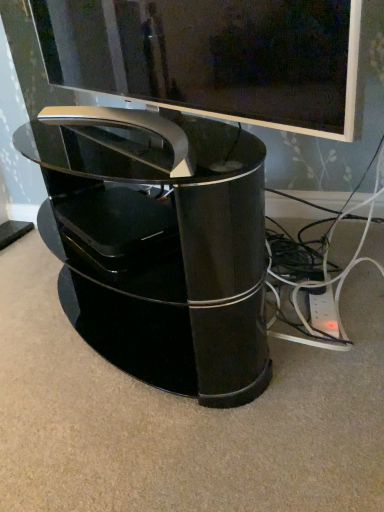
Identify the location of glossy black tv at upper center. Image resolution: width=384 pixels, height=512 pixels. (213, 57).

The width and height of the screenshot is (384, 512). Describe the element at coordinates (213, 57) in the screenshot. I see `glossy black tv at upper center` at that location.

What do you see at coordinates (160, 243) in the screenshot?
I see `glossy black tv stand at center` at bounding box center [160, 243].

The height and width of the screenshot is (512, 384). In order to click on glossy black tv stand at center in this screenshot , I will do `click(160, 243)`.

The height and width of the screenshot is (512, 384). Identify the location of glossy black tv at upper center. (213, 57).

Is glossy black tv at upper center at the right side of glossy black tv stand at center?

No.

Is glossy black tv at upper center closer to the viewer compared to glossy black tv stand at center?

Yes.

Is point (33, 8) behind point (79, 297)?

Yes, it is behind point (79, 297).

From the image's perspective, between glossy black tv at upper center and glossy black tv stand at center, who is located below?

glossy black tv stand at center appears lower in the image.

From a real-world perspective, is glossy black tv at upper center above or below glossy black tv stand at center?

glossy black tv at upper center is above glossy black tv stand at center.

Looking at this image, which object is wider, glossy black tv at upper center or glossy black tv stand at center?

glossy black tv stand at center is wider.

Who is taller, glossy black tv at upper center or glossy black tv stand at center?

With more height is glossy black tv stand at center.

Who is bigger, glossy black tv at upper center or glossy black tv stand at center?

glossy black tv stand at center.

Is glossy black tv at upper center not within glossy black tv stand at center?

Indeed, glossy black tv at upper center is completely outside glossy black tv stand at center.

Is glossy black tv at upper center far away from glossy black tv stand at center?

No.

Is glossy black tv at upper center looking in the opposite direction of glossy black tv stand at center?

glossy black tv at upper center does not have its back to glossy black tv stand at center.

How different are the orientations of glossy black tv at upper center and glossy black tv stand at center in degrees?

They differ by 1.19 degrees in their facing directions.

Find the location of `furniture below the glossy black tv at upper center (from a real-world perspective)`. furniture below the glossy black tv at upper center (from a real-world perspective) is located at coordinates (160, 243).

Does glossy black tv stand at center appear on the right side of glossy black tv at upper center?

Yes.

Does glossy black tv stand at center lie in front of glossy black tv at upper center?

No, glossy black tv stand at center is further to the viewer.

Does point (240, 131) come behind point (287, 121)?

Yes.

From the image's perspective, is glossy black tv stand at center positioned above or below glossy black tv at upper center?

Clearly, from the image's perspective, glossy black tv stand at center is below glossy black tv at upper center.

From a real-world perspective, which is physically below, glossy black tv stand at center or glossy black tv at upper center?

From a 3D spatial view, glossy black tv stand at center is below.

Considering the sizes of objects glossy black tv stand at center and glossy black tv at upper center in the image provided, who is wider, glossy black tv stand at center or glossy black tv at upper center?

glossy black tv stand at center is wider.

Between glossy black tv stand at center and glossy black tv at upper center, which one has more height?

Standing taller between the two is glossy black tv stand at center.

Considering the relative sizes of glossy black tv stand at center and glossy black tv at upper center in the image provided, is glossy black tv stand at center bigger than glossy black tv at upper center?

Indeed, glossy black tv stand at center has a larger size compared to glossy black tv at upper center.

From the picture: Would you say glossy black tv stand at center is inside or outside glossy black tv at upper center?

The correct answer is: outside.

Are glossy black tv stand at center and glossy black tv at upper center making contact?

No, glossy black tv stand at center is not beside glossy black tv at upper center.

Looking at this image, is glossy black tv stand at center looking in the opposite direction of glossy black tv at upper center?

No, glossy black tv stand at center is not facing away from glossy black tv at upper center.

How far apart are glossy black tv stand at center and glossy black tv at upper center?

glossy black tv stand at center is 25.90 centimeters away from glossy black tv at upper center.

Locate an element on the screen. This screenshot has height=512, width=384. furniture on the right of glossy black tv at upper center is located at coordinates [x=160, y=243].

Locate an element on the screen. furniture lying behind the glossy black tv at upper center is located at coordinates (160, 243).

You are a GUI agent. You are given a task and a screenshot of the screen. Output one action in this format:
    pyautogui.click(x=<x>, y=<y>)
    Task: Click on the furniture that is on the right side of glossy black tv at upper center
    
    Given the screenshot: What is the action you would take?
    pyautogui.click(x=160, y=243)